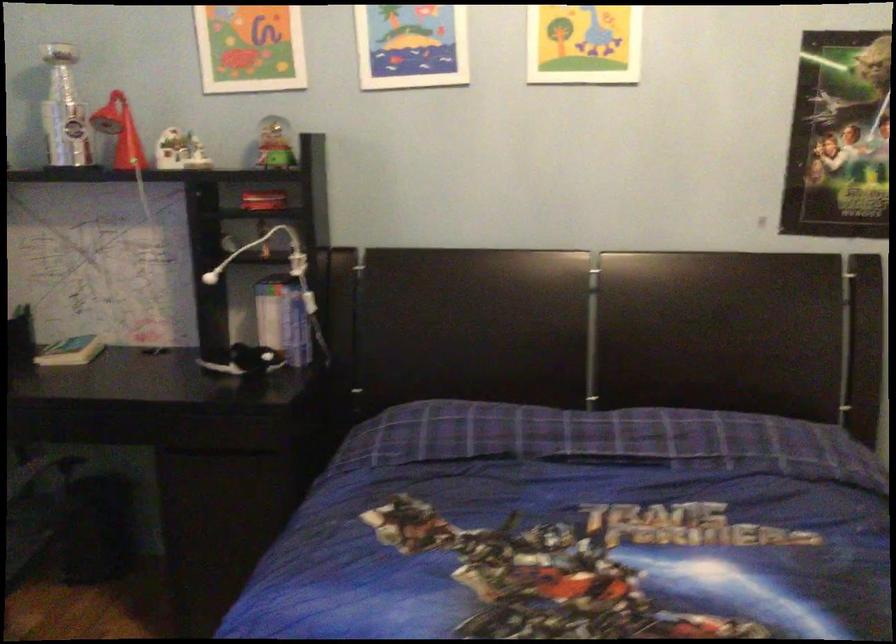
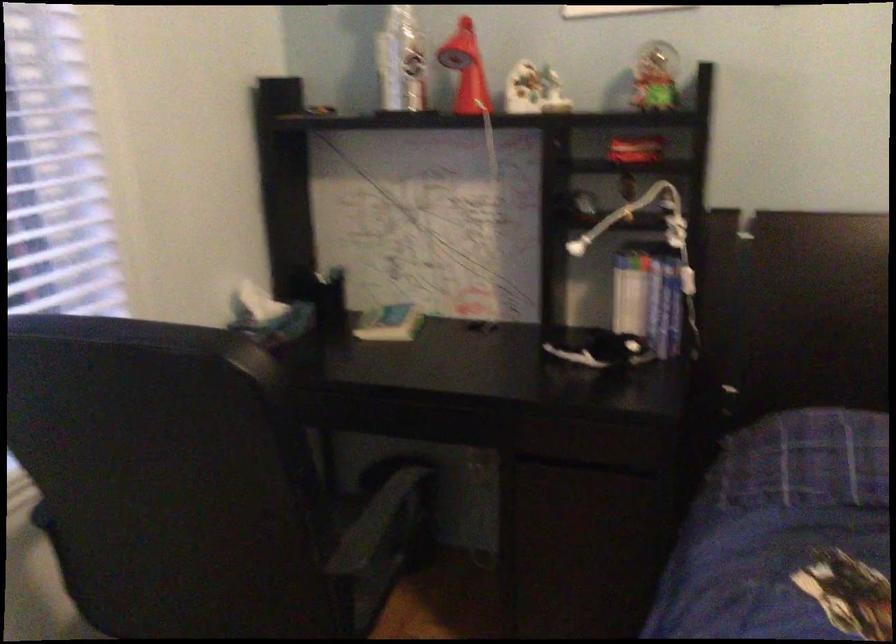
The point at (x=270, y=319) is marked in the first image. Where is the corresponding point in the second image?

(629, 301)